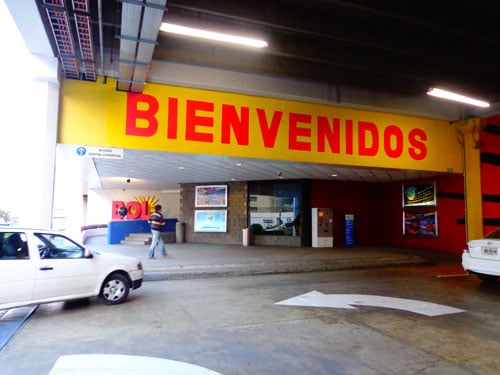
Locate an element on the screen. The image size is (500, 375). bienvenidos sign is located at coordinates (258, 146).